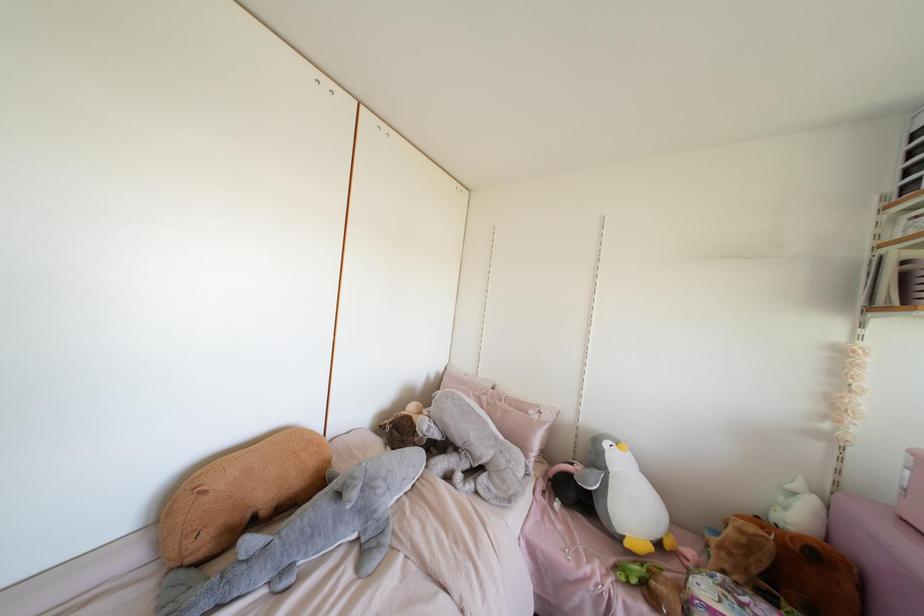
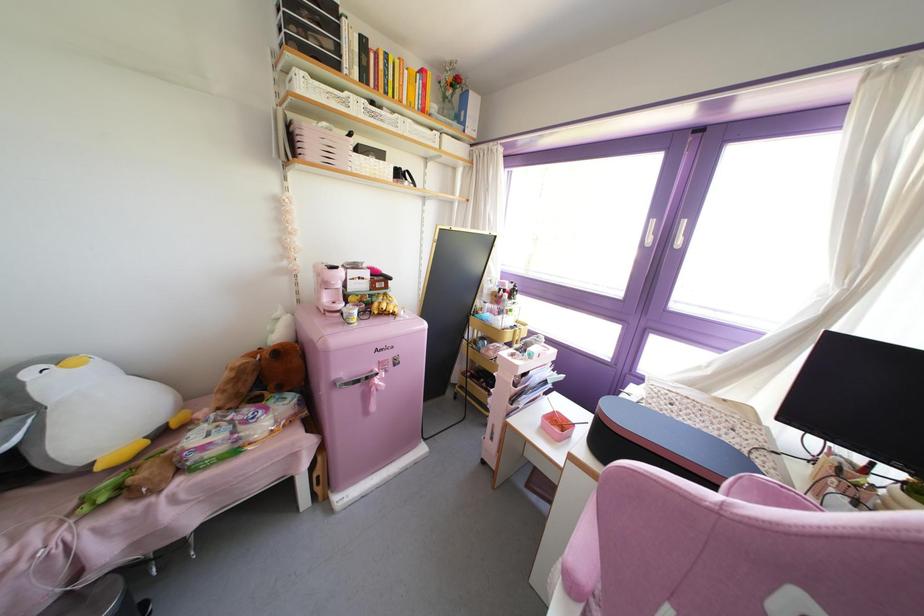
The point at (626, 544) is marked in the first image. Where is the corresponding point in the second image?

(99, 467)